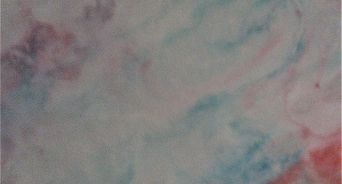
You are a GUI agent. You are given a task and a screenshot of the screen. Output one action in this format:
    pyautogui.click(x=<x>, y=<y>)
    Task: Click on the painting
    This screenshot has height=184, width=342.
    Given the screenshot: What is the action you would take?
    pyautogui.click(x=184, y=97)